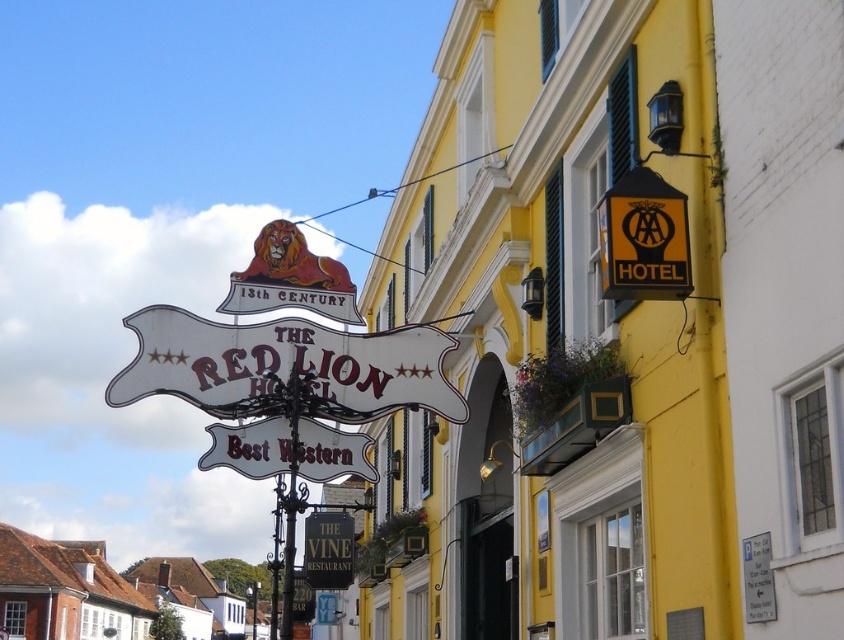
Question: Is white matte signboard at center further to the viewer compared to brown tiled roofs at lower left?

Choices:
 (A) yes
 (B) no

Answer: (B)

Question: From the image, what is the correct spatial relationship of white matte signboard at center in relation to black wrought iron pole at center?

Choices:
 (A) left
 (B) right

Answer: (B)

Question: Which object is farther from the camera taking this photo?

Choices:
 (A) black signboard at center
 (B) white matte signboard at center
 (C) black wrought iron pole at center
 (D) brown tiled roofs at lower left

Answer: (D)

Question: In this image, where is brown tiled roofs at lower left located relative to black signboard at center?

Choices:
 (A) below
 (B) above

Answer: (A)

Question: Which point is closer to the camera?

Choices:
 (A) brown tiled roofs at lower left
 (B) white matte signboard at center
 (C) black signboard at center
 (D) black wrought iron pole at center

Answer: (B)

Question: Which point is closer to the camera?

Choices:
 (A) (339, 516)
 (B) (280, 608)
 (C) (131, 605)
 (D) (441, 371)

Answer: (D)